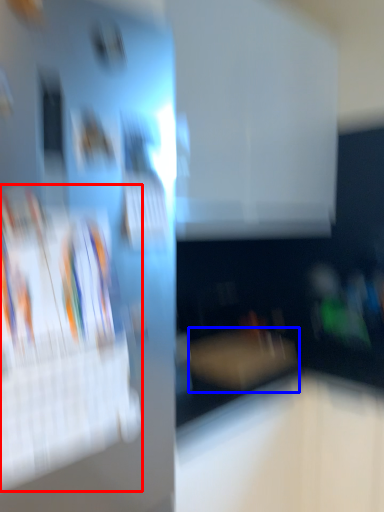
Question: Which point is further to the camera, magazine (highlighted by a red box) or furniture (highlighted by a blue box)?

Choices:
 (A) magazine
 (B) furniture

Answer: (B)